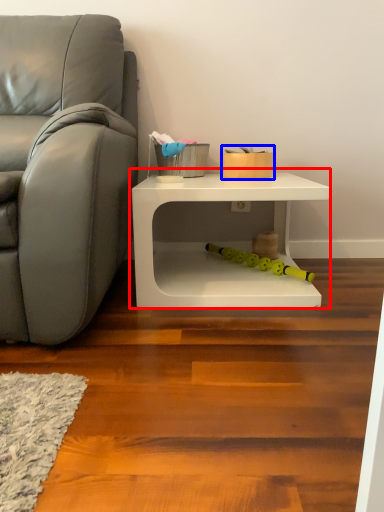
Question: Which object appears farthest to the camera in this image, table (highlighted by a red box) or toy (highlighted by a blue box)?

Choices:
 (A) table
 (B) toy

Answer: (B)